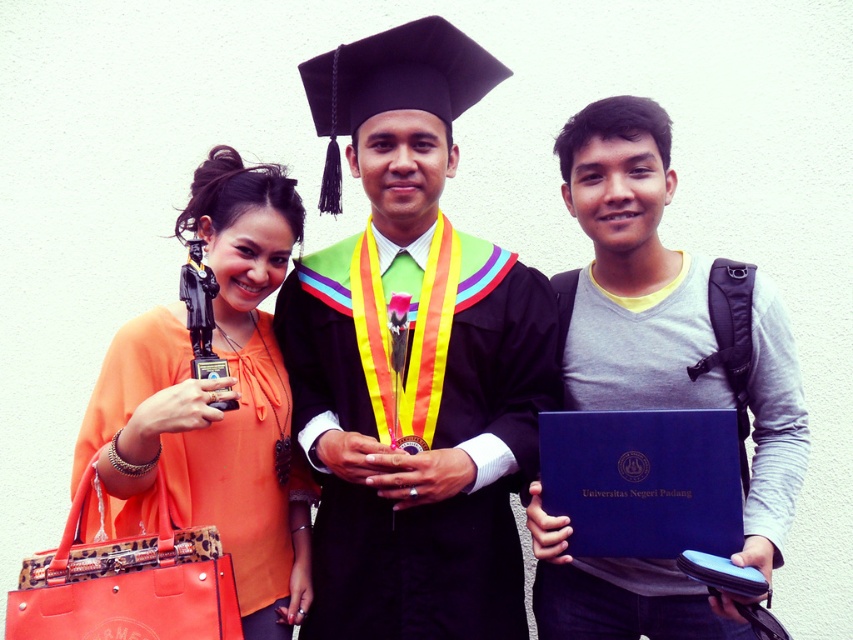
Question: From the image, what is the correct spatial relationship of matte black graduation gown at center in relation to orange fabric purse at left?

Choices:
 (A) right
 (B) left

Answer: (A)

Question: Which object is the closest to the matte black graduation gown at center?

Choices:
 (A) gray matte backpack at center
 (B) orange fabric purse at left

Answer: (B)

Question: Based on their relative distances, which object is farther from the orange fabric purse at left?

Choices:
 (A) gray matte backpack at center
 (B) matte black graduation gown at center

Answer: (A)

Question: Which object appears farthest from the camera in this image?

Choices:
 (A) matte black graduation gown at center
 (B) orange fabric purse at left
 (C) gray matte backpack at center

Answer: (A)

Question: Does matte black graduation gown at center come in front of orange fabric purse at left?

Choices:
 (A) no
 (B) yes

Answer: (A)

Question: Is matte black graduation gown at center positioned before orange fabric purse at left?

Choices:
 (A) no
 (B) yes

Answer: (A)